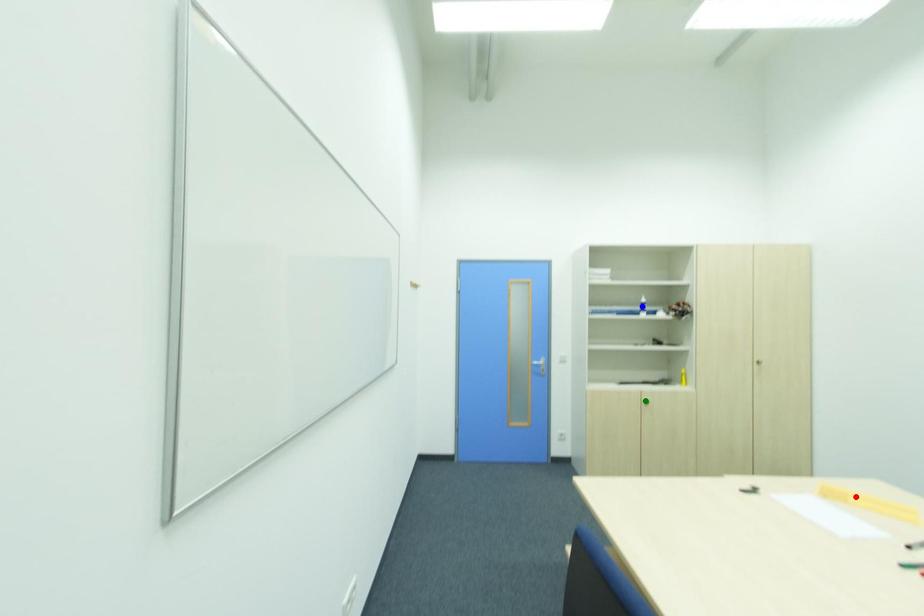
Order these from farthest to nearest:
A) red point
B) green point
C) blue point

blue point → green point → red point